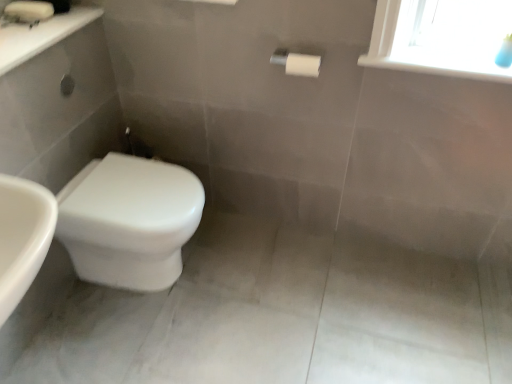
Find the location of a particular element. Image resolution: width=512 pixels, height=384 pixels. blank space above white glossy sink at upper left (from a real-world perspective) is located at coordinates (38, 21).